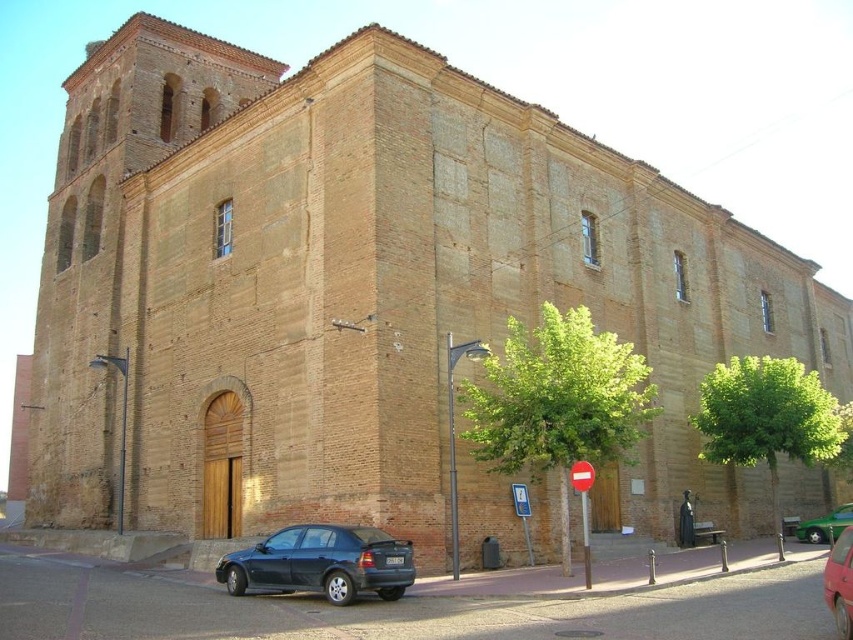
You are a delivery person trying to park your vehicle between the matte black sedan at lower left and the metallic red car at lower right. Given that your delivery van is 5 meters long, can you fit it in the space between them?

The matte black sedan at lower left is smaller than the metallic red car at lower right, but the distance between them isn

You are standing in front of a historic brick building with two green trees and a black car nearby. You want to reach a specific point marked at coordinates point (535, 468). If you can walk 50 meters in 10 minutes, will you be able to reach that point within that time?

The distance of point (535, 468) from camera is 48.78 meters. Since you can walk 50 meters in 10 minutes, you can reach the point within the time.